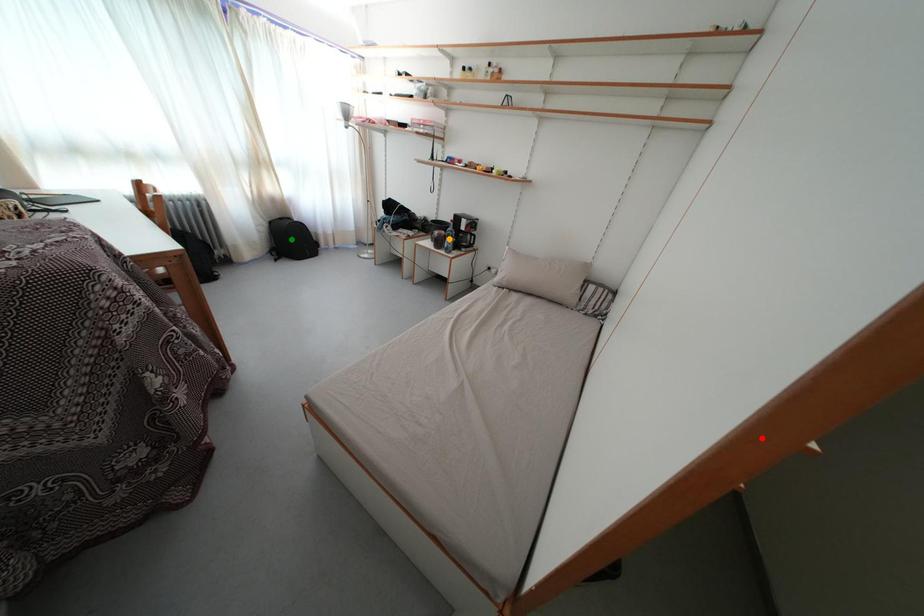
Order these from farthest to nearest:
red point, green point, orange point

green point → orange point → red point